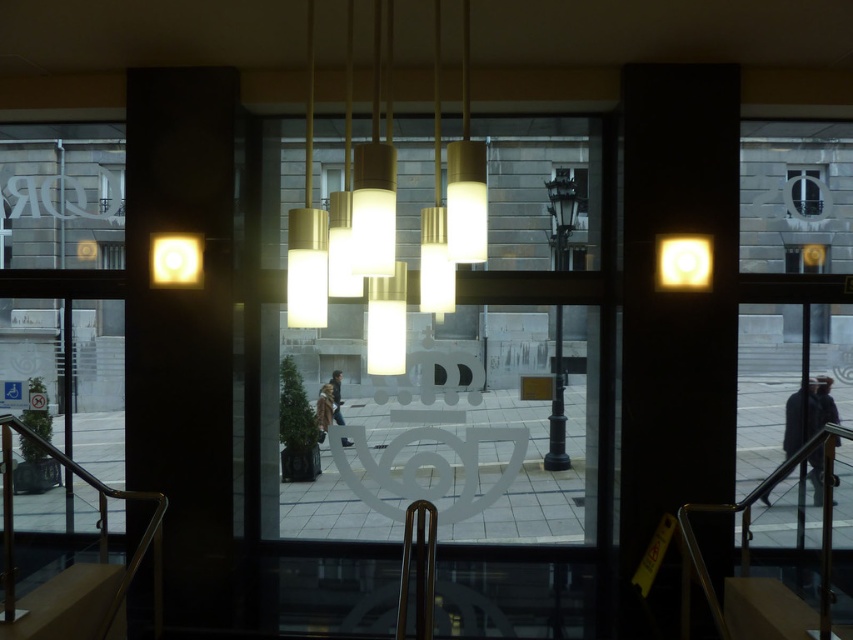
You are standing at the entrance of the building and want to hang a new pendant light between the matte white light at upper right and the matte yellow light at upper left. The new light requires a minimum of 3 meters of space between it and the existing lights. Is there enough space?

The distance between the matte white light at upper right and the matte yellow light at upper left is 3.01 meters. Since the new light requires at least 3 meters of space between it and the existing lights, there is just enough space to install it between them.

Consider the image. You are standing at the entrance of the modern building and notice the matte white light at upper right. If you want to reach it quickly, should you move forward towards the glass door or step back into the building?

The matte white light at upper right is 5.00 meters away from viewer, so you should move forward towards the glass door to reach it quickly since it is closer to the door than deeper inside the building.